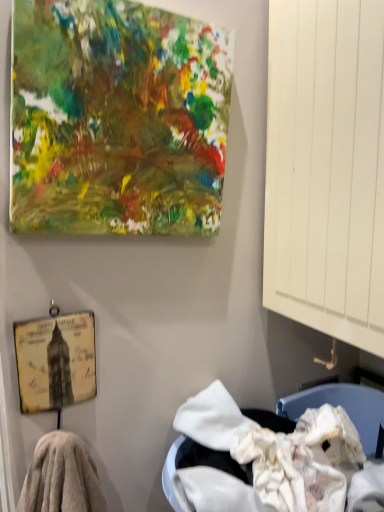
Question: From the image's perspective, is fuzzy towel at lower left above or below abstract multicolored canvas at upper left?

Choices:
 (A) above
 (B) below

Answer: (B)

Question: Considering the positions of fuzzy towel at lower left and abstract multicolored canvas at upper left in the image, is fuzzy towel at lower left bigger or smaller than abstract multicolored canvas at upper left?

Choices:
 (A) small
 (B) big

Answer: (A)

Question: Which of these objects is positioned closest to the yellowed paper picture frame at lower left?

Choices:
 (A) fuzzy towel at lower left
 (B) abstract multicolored canvas at upper left

Answer: (A)

Question: Estimate the real-world distances between objects in this image. Which object is farther from the abstract multicolored canvas at upper left?

Choices:
 (A) fuzzy towel at lower left
 (B) yellowed paper picture frame at lower left

Answer: (A)